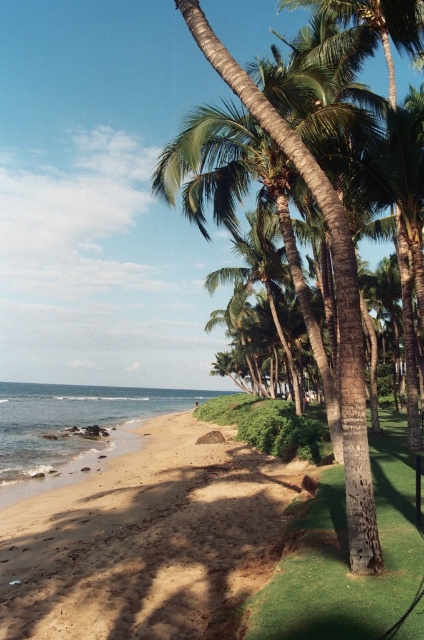
You are a landscape architect designing a garden. You need to place a small statue that requires a stable, flat surface. Which of the two options, the green artificial turf at center or the clear water at lower left, would be more suitable for placing the statue?

A: The green artificial turf at center has a lesser height compared to clear water at lower left, so placing the statue on the green artificial turf at center would provide a stable, flat surface since it is lower and more level than the clear water at lower left.

You are standing at the edge of the beach and want to walk towards the brown sandy beach at lower left and the clear water at lower left. Which area will you step into first?

The brown sandy beach at lower left is smaller than the clear water at lower left, so you will step into the clear water at lower left first.